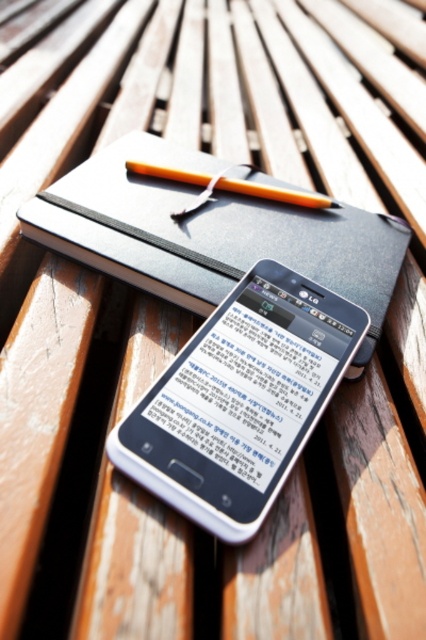
Question: Which point is farther to the camera?

Choices:
 (A) orange wood pen at center
 (B) white glossy smartphone at center

Answer: (A)

Question: Does white glossy smartphone at center lie behind orange wood pen at center?

Choices:
 (A) yes
 (B) no

Answer: (B)

Question: Which object is farther from the camera taking this photo?

Choices:
 (A) white glossy smartphone at center
 (B) orange wood pen at center

Answer: (B)

Question: Is white glossy smartphone at center further to camera compared to orange wood pen at center?

Choices:
 (A) no
 (B) yes

Answer: (A)

Question: Among these points, which one is farthest from the camera?

Choices:
 (A) (255, 408)
 (B) (282, 188)

Answer: (B)

Question: Does white glossy smartphone at center have a larger size compared to orange wood pen at center?

Choices:
 (A) yes
 (B) no

Answer: (A)